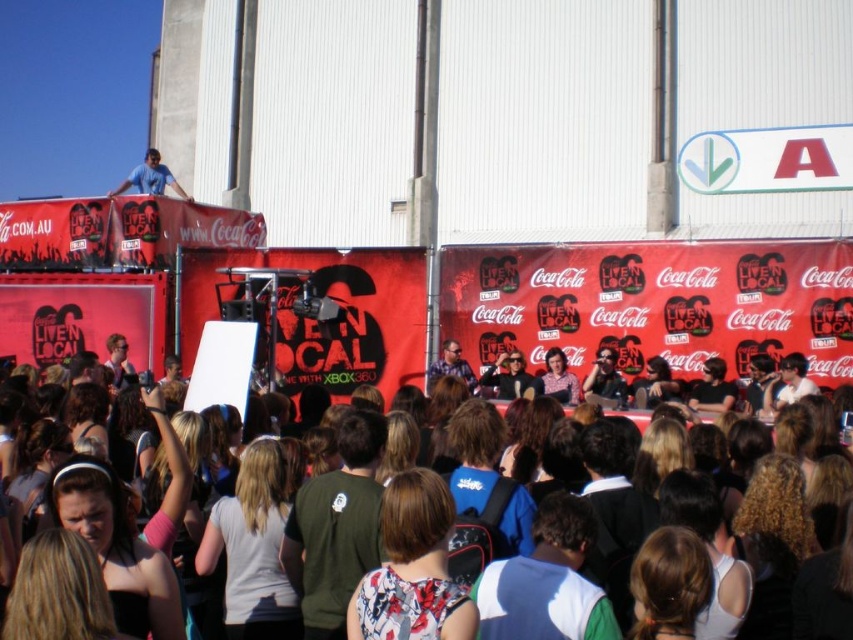
Does brown hair at center appear over matte black sunglasses at center?

No, brown hair at center is not above matte black sunglasses at center.

Can you confirm if brown hair at center is shorter than matte black sunglasses at center?

No, brown hair at center is not shorter than matte black sunglasses at center.

Who is more distant from viewer, (833, 464) or (454, 369)?

The point (454, 369) is behind.

The width and height of the screenshot is (853, 640). Find the location of `brown hair at center`. brown hair at center is located at coordinates (195, 422).

Does matte blue shirt at upper left have a greater height compared to matte black sunglasses at center?

Yes.

Between matte blue shirt at upper left and matte black sunglasses at center, which one appears on the left side from the viewer's perspective?

matte blue shirt at upper left

Where is `matte blue shirt at upper left`? Image resolution: width=853 pixels, height=640 pixels. matte blue shirt at upper left is located at coordinates (149, 177).

Locate an element on the screen. This screenshot has height=640, width=853. matte blue shirt at upper left is located at coordinates (149, 177).

Which is behind, point (502, 454) or point (146, 193)?

Positioned behind is point (146, 193).

Is point (10, 456) farther from viewer compared to point (160, 172)?

That is False.

Image resolution: width=853 pixels, height=640 pixels. I want to click on brown hair at center, so click(x=195, y=422).